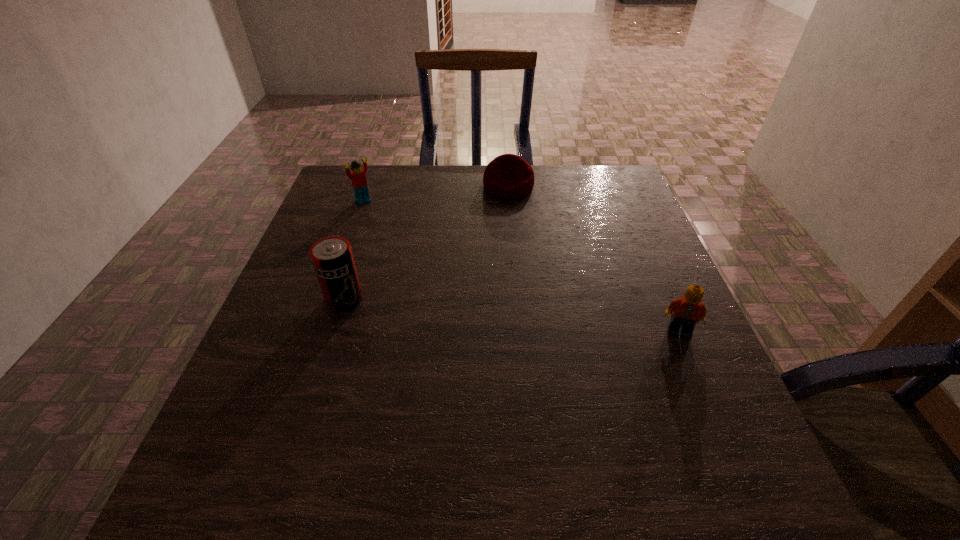
Where is `vacant area that satisfies the following two spatial constraints: 1. on the front side of the can; 2. on the right side of the farther Lego`? vacant area that satisfies the following two spatial constraints: 1. on the front side of the can; 2. on the right side of the farther Lego is located at coordinates (329, 299).

The height and width of the screenshot is (540, 960). Find the location of `blank space that satisfies the following two spatial constraints: 1. on the front side of the tallest object; 2. on the left side of the left Lego`. blank space that satisfies the following two spatial constraints: 1. on the front side of the tallest object; 2. on the left side of the left Lego is located at coordinates (329, 299).